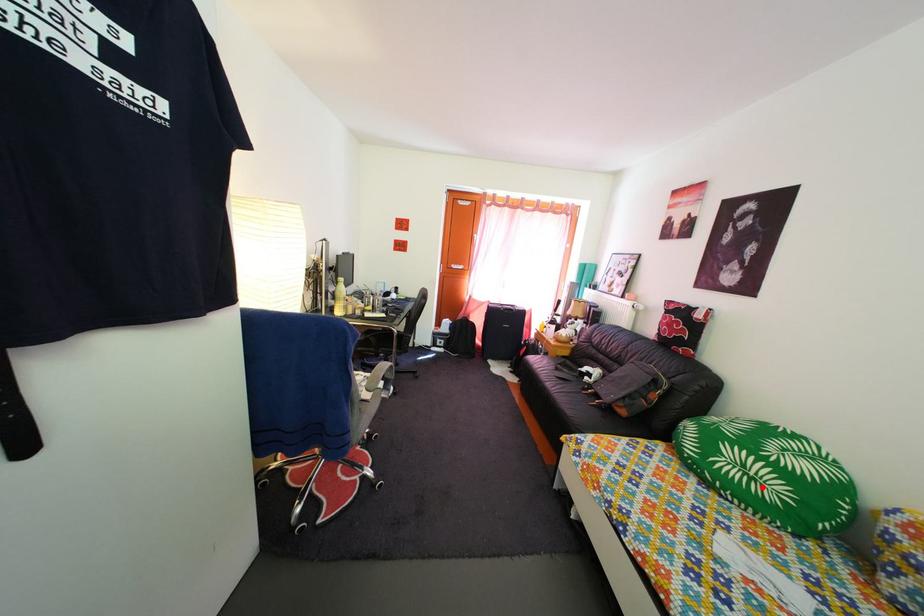
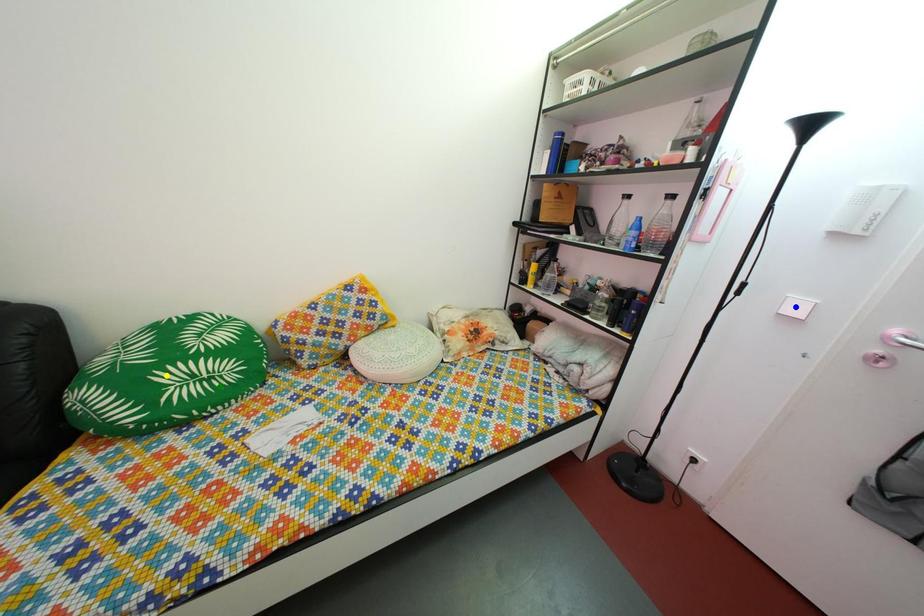
Question: I am providing you with two images of the same scene from different viewpoints. A red point is marked on the first image. You are given multiple points on the second image. In image 2, which mark is for the same physical point as the one in image 1?

Choices:
 (A) blue point
 (B) yellow point
 (C) green point

Answer: (C)